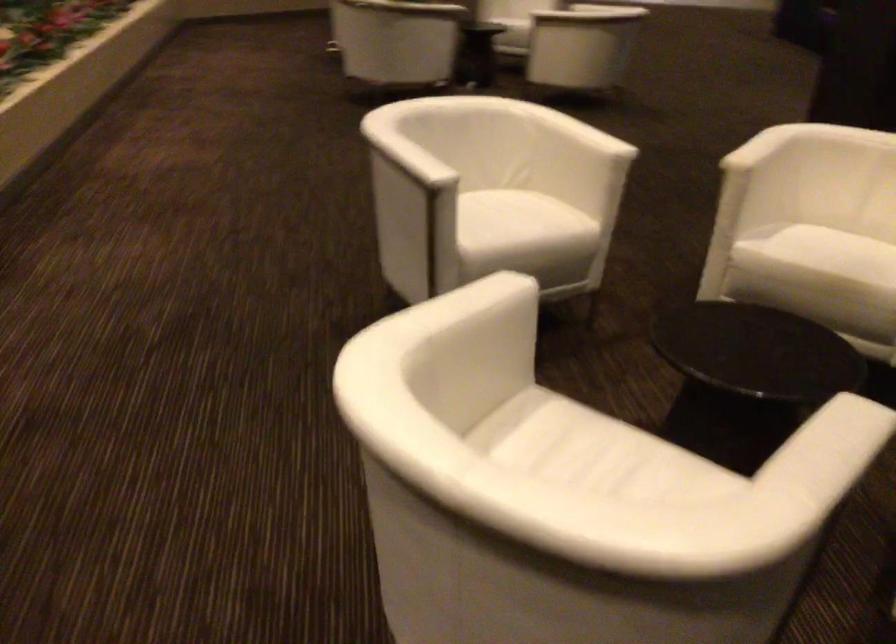
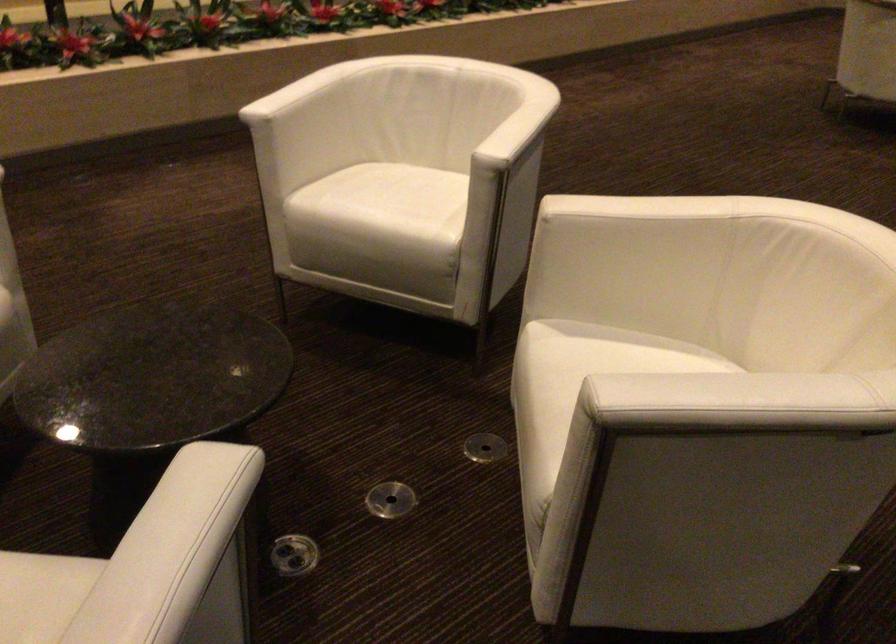
Locate, in the second image, the point that corresponds to point (362, 196) in the first image.

(571, 180)